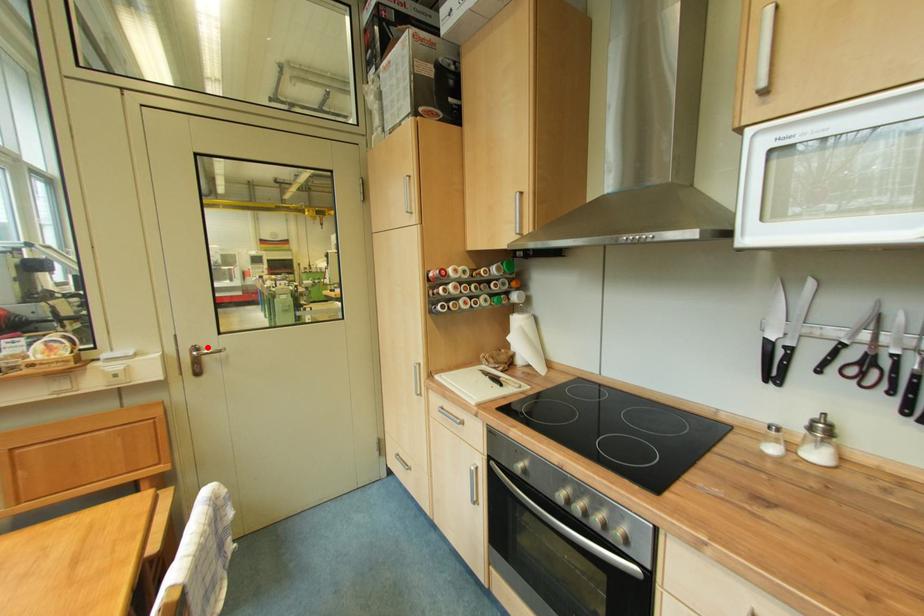
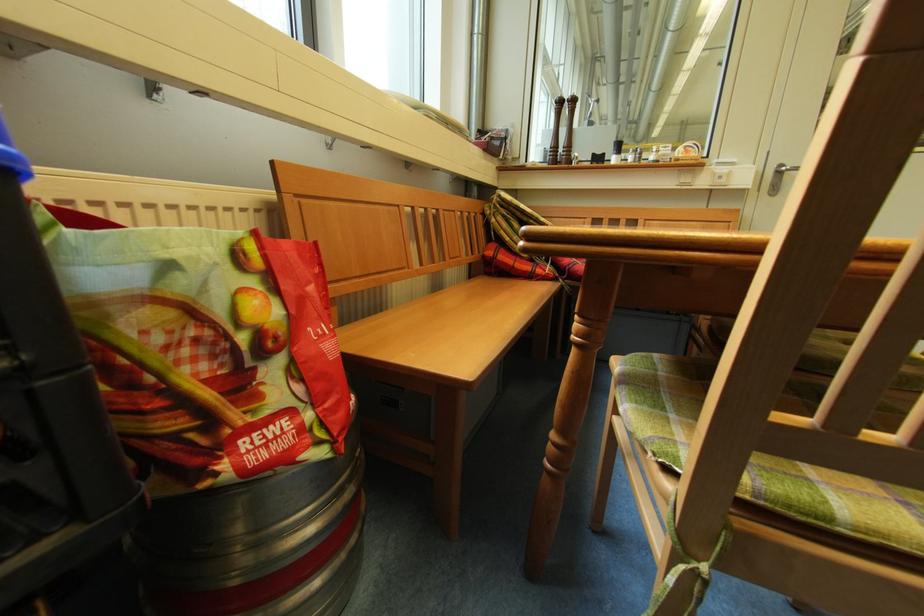
Where in the second image is the point corresponding to the highlighted location from the first image?

(795, 167)